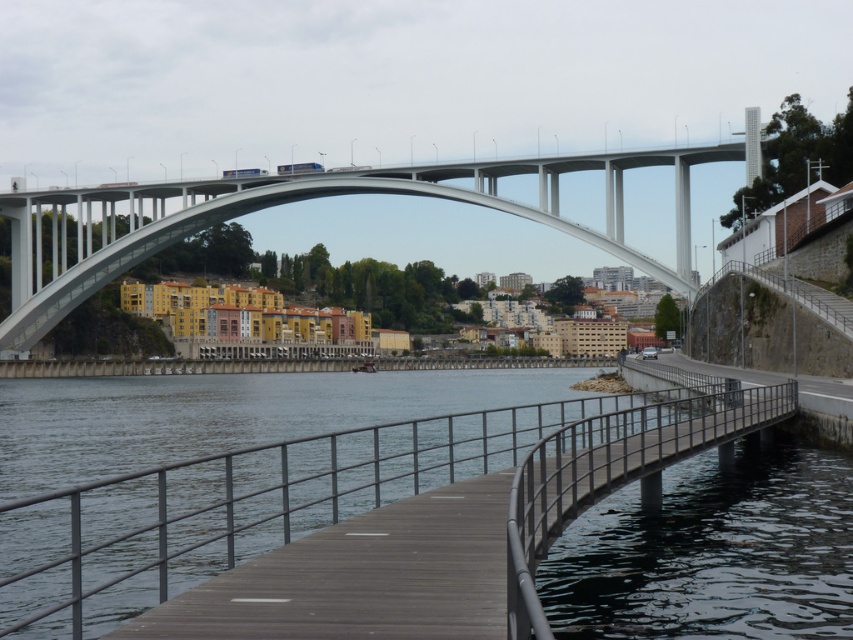
Question: Is wooden at center above white concrete arch bridge at upper center?

Choices:
 (A) no
 (B) yes

Answer: (A)

Question: Which of the following is the farthest from the observer?

Choices:
 (A) pyautogui.click(x=44, y=285)
 (B) pyautogui.click(x=757, y=397)

Answer: (A)

Question: Is wooden at center below white concrete arch bridge at upper center?

Choices:
 (A) no
 (B) yes

Answer: (B)

Question: Which object is closer to the camera taking this photo?

Choices:
 (A) wooden at center
 (B) white concrete arch bridge at upper center

Answer: (A)

Question: Considering the relative positions of wooden at center and white concrete arch bridge at upper center in the image provided, where is wooden at center located with respect to white concrete arch bridge at upper center?

Choices:
 (A) above
 (B) below

Answer: (B)